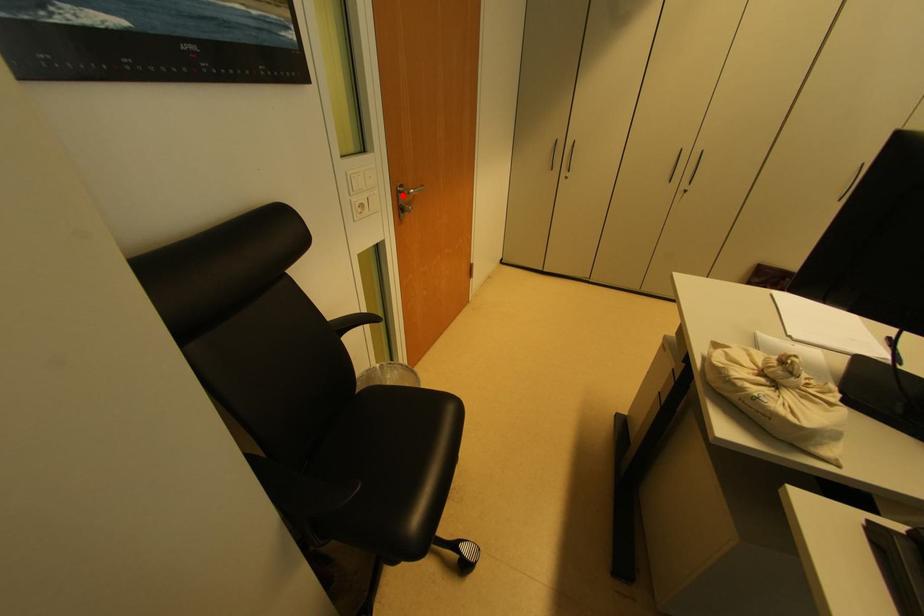
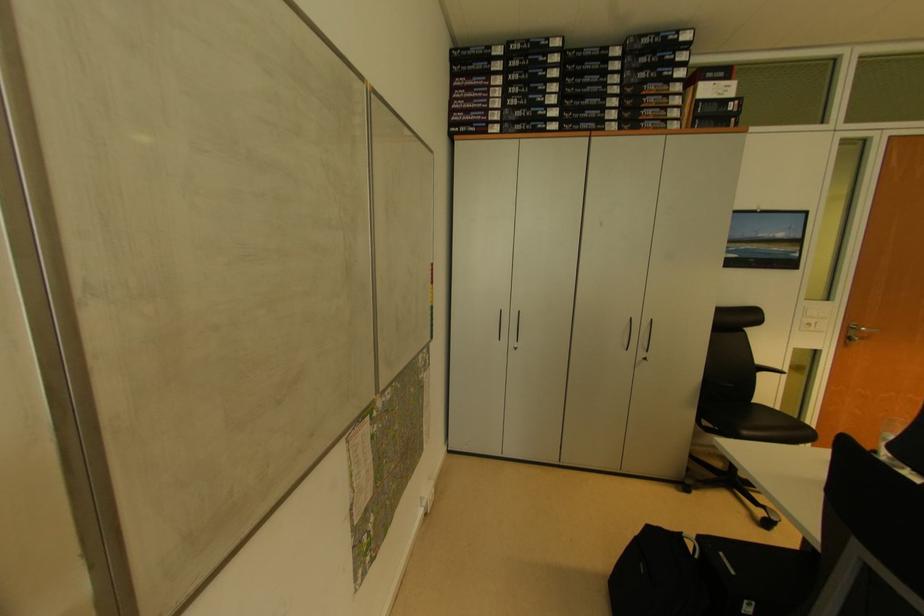
Where in the second image is the point corresponding to the highlighted location from the first image?

(855, 331)